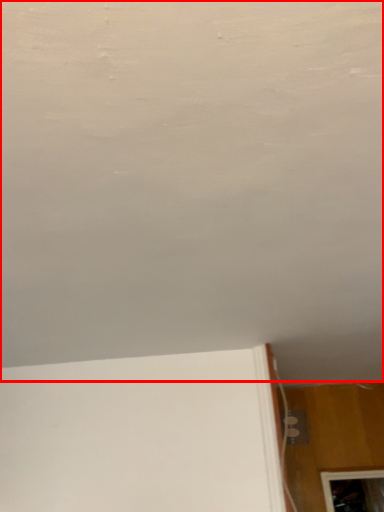
Question: From the image's perspective, where is backdrop (annotated by the red box) located in relation to electric outlet in the image?

Choices:
 (A) below
 (B) above

Answer: (B)